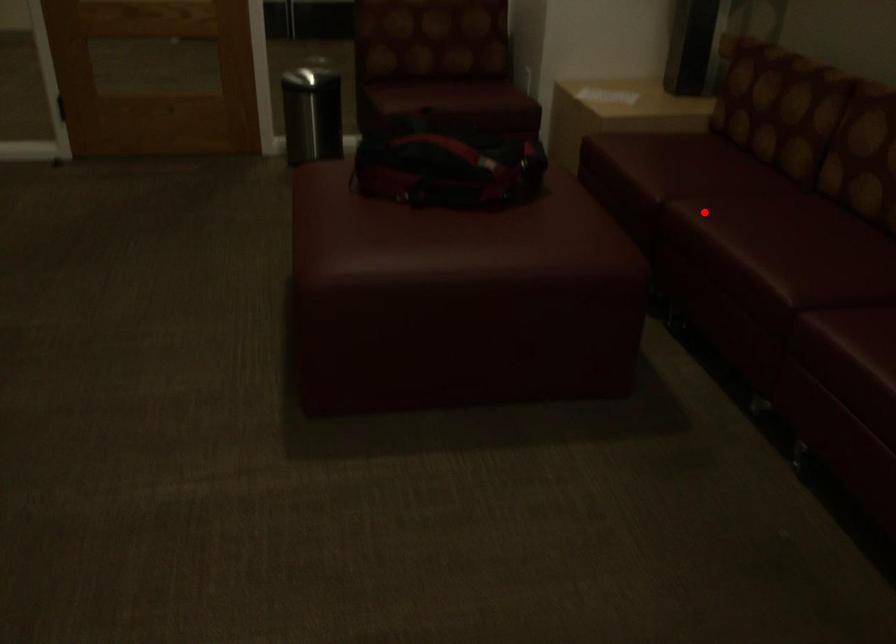
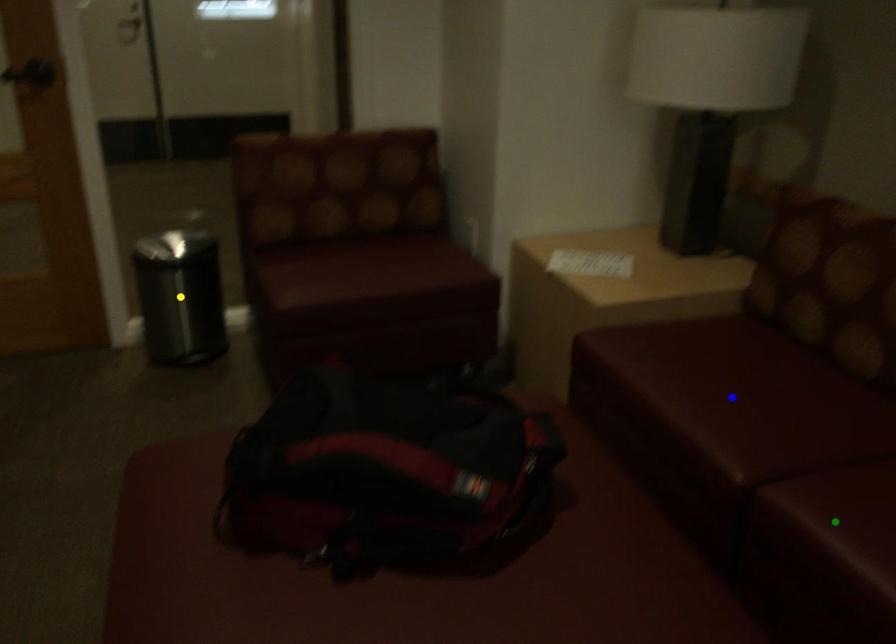
Question: I am providing you with two images of the same scene from different viewpoints. A red point is marked on the first image. You are given multiple points on the second image. Which point in image 2 is actually the same real-world point as the red point in image 1?

Choices:
 (A) yellow point
 (B) blue point
 (C) green point

Answer: (C)